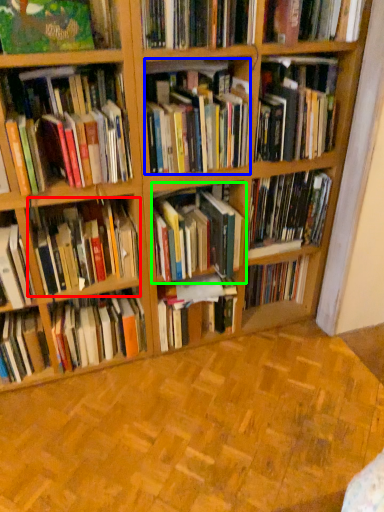
Question: Estimate the real-world distances between objects in this image. Which object is farther from book (highlighted by a red box), book (highlighted by a blue box) or book (highlighted by a green box)?

Choices:
 (A) book
 (B) book

Answer: (A)